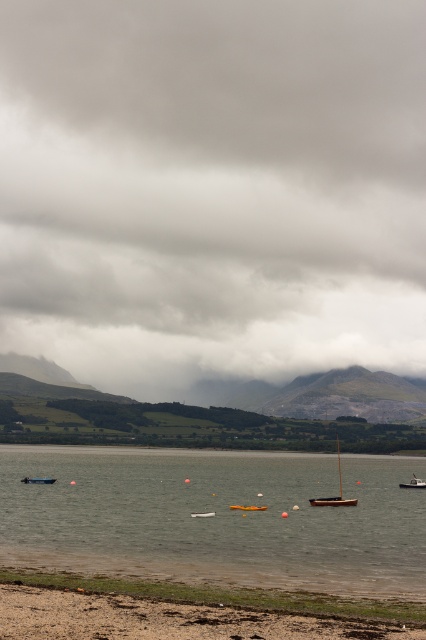
You are standing on the beach and see the clear water at lower center and the wooden boat at center. Which one is taller?

The clear water at lower center has a greater height compared to the wooden boat at center, so the clear water at lower center is taller.

You are standing on the beach and notice the gray cloudy sky at upper center and the clear water at lower center. Which object is positioned to the left when looking at the scene?

The gray cloudy sky at upper center is to the left of clear water at lower center.